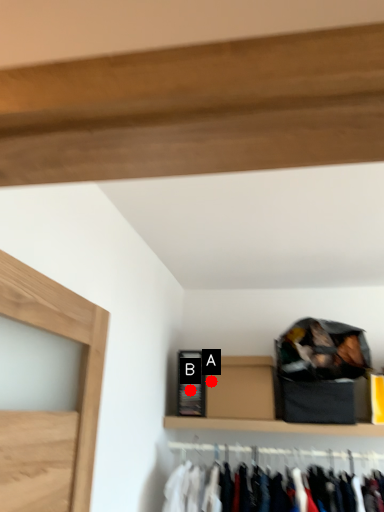
Question: Two points are circled on the image, labeled by A and B beside each circle. Which point appears farthest from the camera in this image?

Choices:
 (A) A is further
 (B) B is further

Answer: (B)